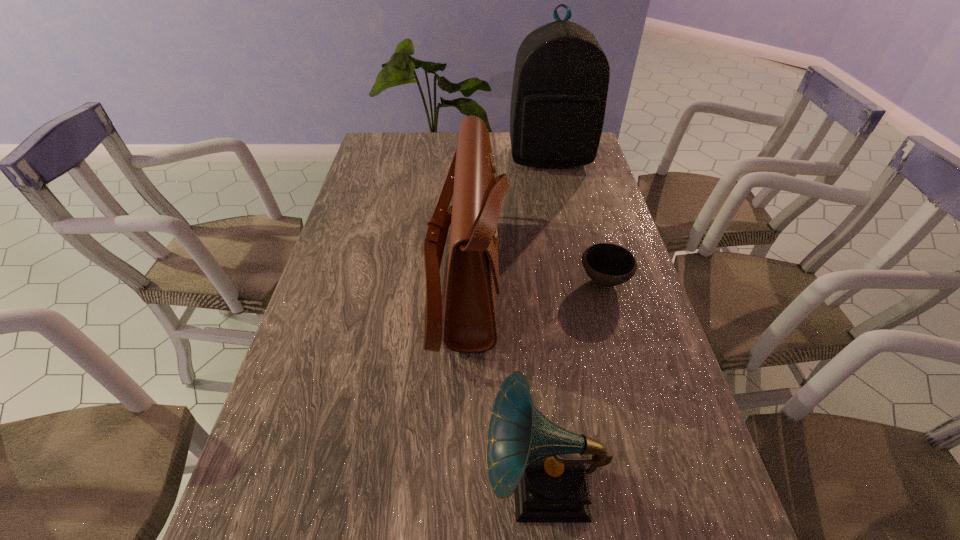
Locate an element on the screen. The image size is (960, 540). backpack is located at coordinates (561, 78).

The width and height of the screenshot is (960, 540). What are the coordinates of `the tallest object` in the screenshot? It's located at (561, 78).

At what (x,y) coordinates should I click in order to perform the action: click on satchel. Please return your answer as a coordinate pair (x, y). Looking at the image, I should click on (470, 326).

Find the location of `bowl`. bowl is located at coordinates (608, 265).

Locate an element on the screen. Image resolution: width=960 pixels, height=540 pixels. vacant position located on the front-facing side of the tallest object is located at coordinates coord(559,197).

Identify the location of vacant space situated on the front flap of the satchel. The height and width of the screenshot is (540, 960). (635, 276).

I want to click on free space located on the left of the shortest object, so click(472, 281).

What are the coordinates of `object at the far edge` in the screenshot? It's located at (561, 78).

I want to click on backpack at the right edge, so (561, 78).

I want to click on bowl that is at the right edge, so click(608, 265).